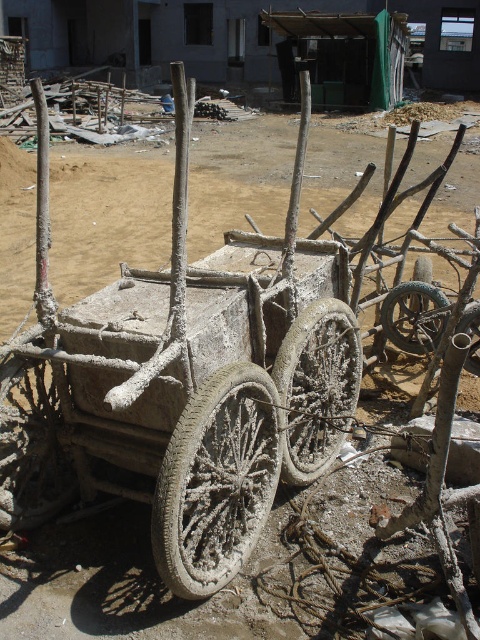
Question: Which point is closer to the camera taking this photo?

Choices:
 (A) (469, 360)
 (B) (429, 314)
 (C) (295, 340)

Answer: (C)

Question: Which of the following is the farthest from the observer?

Choices:
 (A) (414, 349)
 (B) (466, 324)
 (C) (183, 492)
 (D) (303, 356)

Answer: (A)

Question: Does gray textured wheel at center come in front of white dusty wheel at center?

Choices:
 (A) yes
 (B) no

Answer: (A)

Question: Which point appears farthest from the camera in this image?

Choices:
 (A) (44, 404)
 (B) (399, 330)
 (C) (479, 324)

Answer: (B)

Question: Is gray textured wheel at center behind white dusty wheel at center?

Choices:
 (A) yes
 (B) no

Answer: (B)

Question: Is gray concrete wheel at center above rusty metal wheel at center?

Choices:
 (A) no
 (B) yes

Answer: (A)